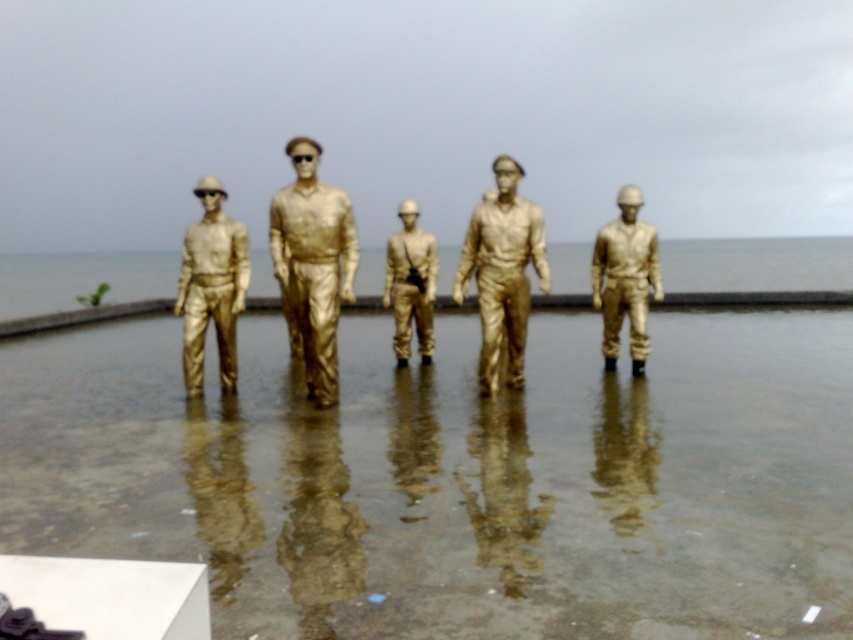
Question: Which of the following is the farthest from the observer?

Choices:
 (A) gold metallic soldier at center
 (B) gold metallic figure at center
 (C) shiny gold statue at center
 (D) gold metallic statue at left

Answer: (B)

Question: Which object is farther from the camera taking this photo?

Choices:
 (A) gold metallic statue at left
 (B) gold metallic statue at center
 (C) shiny gold statue at center
 (D) gold metallic soldier at center

Answer: (D)

Question: Does gold metallic statue at left appear on the left side of gold metallic soldier at center?

Choices:
 (A) yes
 (B) no

Answer: (A)

Question: Which point is farther to the camera?

Choices:
 (A) gold metallic figure at center
 (B) gold metallic soldier at center

Answer: (A)

Question: Can you confirm if gold metallic statue at left is positioned to the right of gold metallic figure at center?

Choices:
 (A) yes
 (B) no

Answer: (B)

Question: Is gold metallic statue at center closer to the viewer compared to gold metallic figure at center?

Choices:
 (A) no
 (B) yes

Answer: (B)